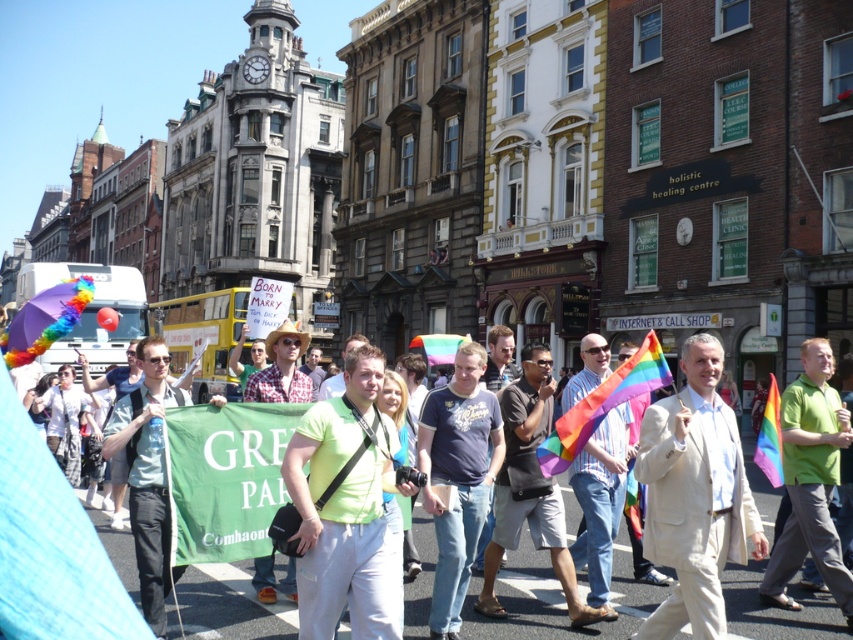
Question: Does white textured suit at center have a larger size compared to green matte shirt at center?

Choices:
 (A) no
 (B) yes

Answer: (A)

Question: Which of the following is the farthest from the observer?

Choices:
 (A) (811, 516)
 (B) (712, 544)

Answer: (A)

Question: Where is white textured suit at center located in relation to green matte shirt at center in the image?

Choices:
 (A) below
 (B) above

Answer: (B)

Question: Which point is closer to the camera?

Choices:
 (A) white textured suit at center
 (B) green matte shirt at center

Answer: (A)

Question: Where is white textured suit at center located in relation to green matte shirt at center in the image?

Choices:
 (A) below
 (B) above

Answer: (B)

Question: Among these points, which one is nearest to the camera?

Choices:
 (A) (819, 372)
 (B) (706, 461)

Answer: (B)